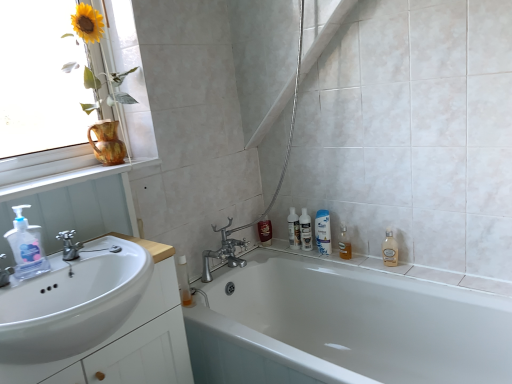
You are a GUI agent. You are given a task and a screenshot of the screen. Output one action in this format:
    pyautogui.click(x=<x>, y=<y>)
    Task: Click on the vacant area that is in front of translucent plastic bottle at lower left
    This screenshot has width=512, height=384.
    Given the screenshot: What is the action you would take?
    pyautogui.click(x=204, y=314)